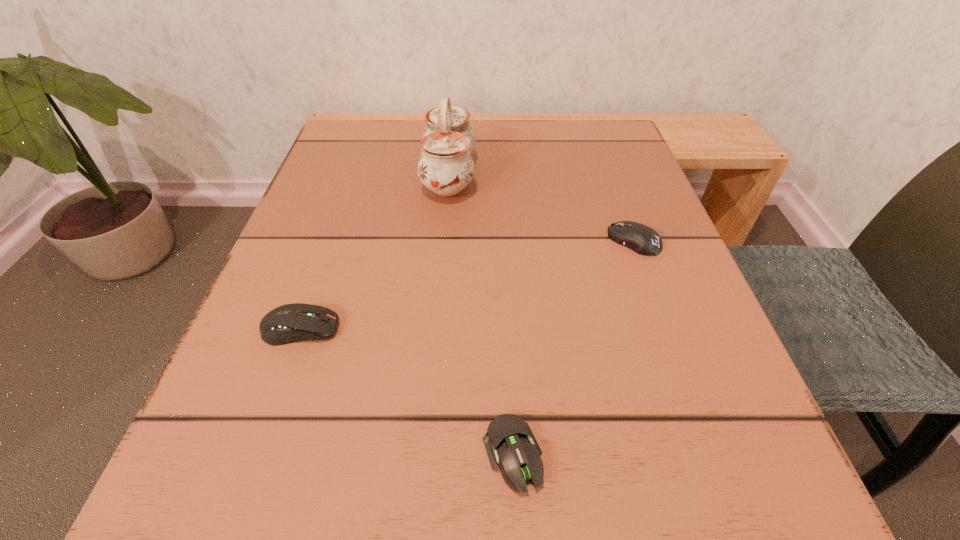
Identify the location of blank area in the image that satisfies the following two spatial constraints: 1. by the handle of the tallest object; 2. on the left side of the rightmost computer mouse. The width and height of the screenshot is (960, 540). (444, 240).